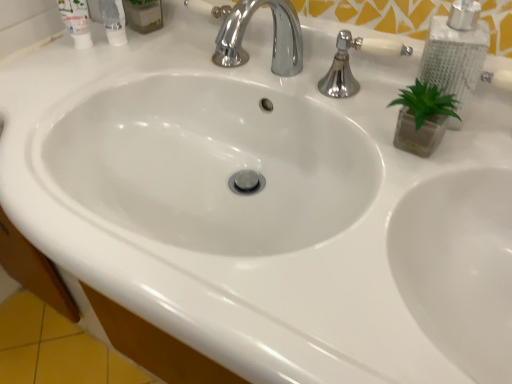
At what (x,y) coordinates should I click in order to perform the action: click on free space to the left of silver metallic soap dispenser at upper right. Please return your answer as a coordinate pair (x, y). This screenshot has height=384, width=512. Looking at the image, I should click on (339, 114).